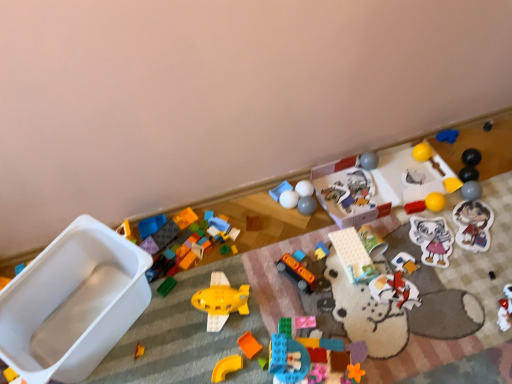
You are a GUI agent. You are given a task and a screenshot of the screen. Output one action in this format:
    pyautogui.click(x=<x>, y=<y>)
    Task: Click on the vacant space that's between yellow matte square at center-right, placed as the 22th toy when sorted from left to right, and translucent plastic blocks at center, positioned as the 15th toy in right-to-left order
    Image resolution: width=512 pixels, height=384 pixels.
    Given the screenshot: What is the action you would take?
    pyautogui.click(x=382, y=282)